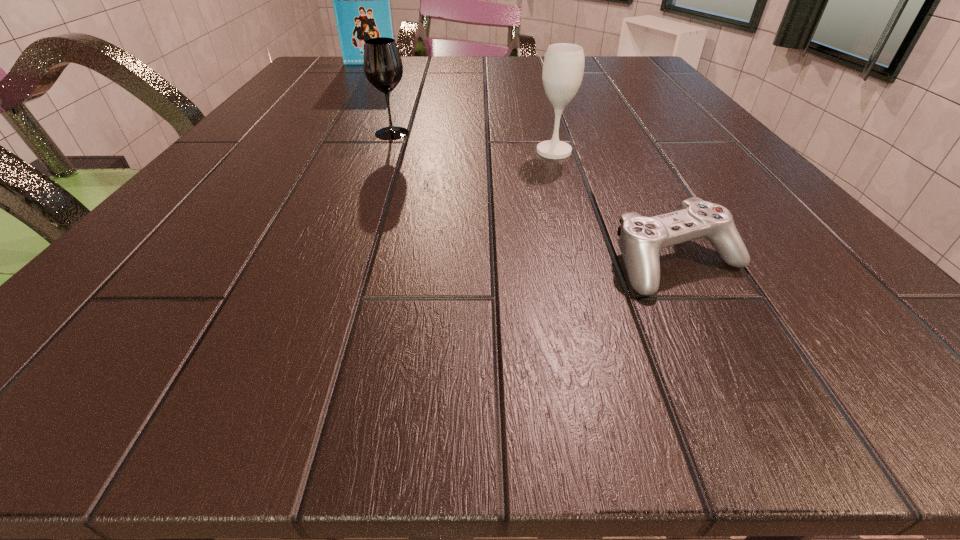
The image size is (960, 540). Identify the location of vacant region at the far right corner of the desktop. (650, 66).

Where is `vacant area that lies between the farther wineglass and the second nearest object`? This screenshot has height=540, width=960. vacant area that lies between the farther wineglass and the second nearest object is located at coordinates (473, 143).

Image resolution: width=960 pixels, height=540 pixels. Identify the location of unoccupied position between the nearer wineglass and the shortest object. (616, 207).

Identify the location of free space between the farther wineglass and the rightmost object. (536, 198).

The height and width of the screenshot is (540, 960). Identify the location of unoccupied area between the nearest object and the leftmost object. (524, 163).

In order to click on free space between the leftmost object and the shortest object in this screenshot , I will do `click(524, 163)`.

I want to click on empty location between the leftmost object and the second object from right to left, so click(x=462, y=107).

Locate an element on the screen. vacant point located between the control and the second farthest object is located at coordinates (536, 198).

Where is `vacant space that's between the farther wineglass and the control`? This screenshot has width=960, height=540. vacant space that's between the farther wineglass and the control is located at coordinates (536, 198).

Image resolution: width=960 pixels, height=540 pixels. Identify the location of vacant space that is in between the farther wineglass and the farthest object. (381, 98).